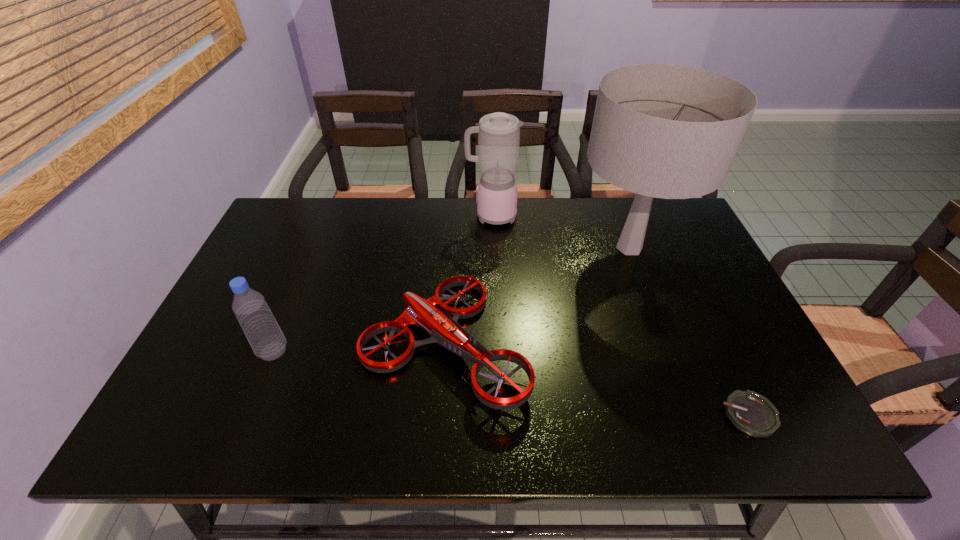
Find the location of a particular element. vacant region located on the base of the food processor near the control knob is located at coordinates (343, 216).

Identify the location of free space located 0.180m on the base of the food processor near the control knob. The height and width of the screenshot is (540, 960). (411, 216).

The image size is (960, 540). What are the coordinates of `vacant space located on the back of the third tallest object` in the screenshot? It's located at (308, 267).

Find the location of a particular element. This screenshot has width=960, height=540. vacant space situated on the left of the second shortest object is located at coordinates (232, 343).

Identify the location of vacant space located on the left of the shortest object. This screenshot has width=960, height=540. (590, 415).

Identify the location of lampshade at the far edge. The image size is (960, 540). (667, 131).

This screenshot has height=540, width=960. Identify the location of food processor that is at the far edge. (498, 133).

Locate an element on the screen. The image size is (960, 540). drone present at the near edge is located at coordinates (445, 331).

Identify the location of ashtray that is at the near edge. (750, 412).

Locate an element on the screen. object at the left edge is located at coordinates (257, 321).